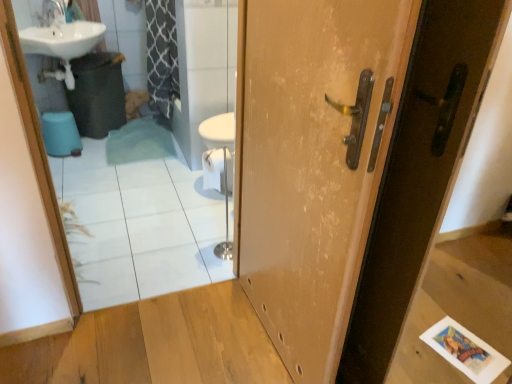
Question: From the image's perspective, is white glossy mirror at upper left located above or below blue plastic toilet bowl at lower left?

Choices:
 (A) below
 (B) above

Answer: (A)

Question: Considering their positions, is white glossy mirror at upper left located in front of or behind blue plastic toilet bowl at lower left?

Choices:
 (A) front
 (B) behind

Answer: (A)

Question: Estimate the real-world distances between objects in this image. Which object is closer to the white glossy mirror at upper left?

Choices:
 (A) wooden door at center
 (B) blue plastic toilet bowl at lower left

Answer: (B)

Question: Which of these objects is positioned farthest from the white glossy mirror at upper left?

Choices:
 (A) blue plastic toilet bowl at lower left
 (B) wooden door at center

Answer: (B)